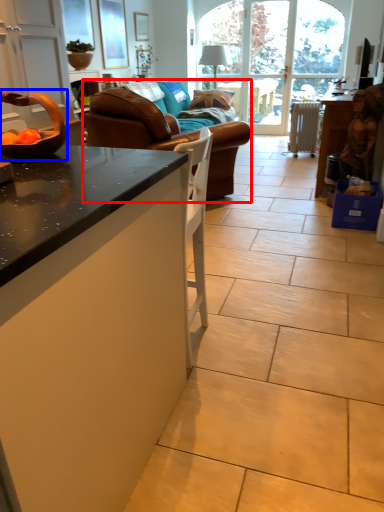
Question: Which object appears farthest to the camera in this image, studio couch (highlighted by a red box) or bowl (highlighted by a blue box)?

Choices:
 (A) studio couch
 (B) bowl

Answer: (A)